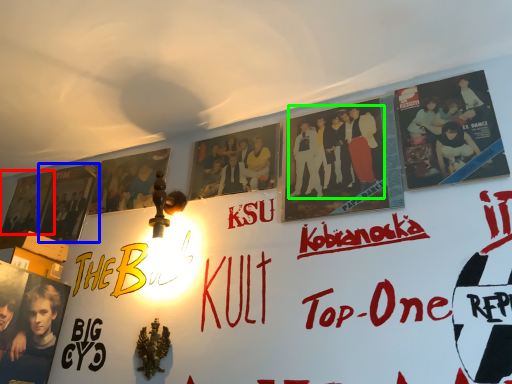
Question: Based on their relative distances, which object is farther from movie poster (highlighted by a red box)? Choose from poster (highlighted by a blue box) and person (highlighted by a green box).

Choices:
 (A) poster
 (B) person

Answer: (B)